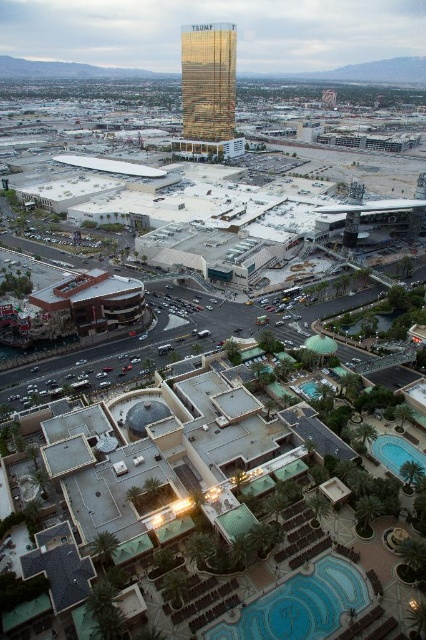
Does red brick building at center have a lesser width compared to blue glossy pool at lower right?

No.

Is red brick building at center shorter than blue glossy pool at lower right?

Incorrect, red brick building at center's height does not fall short of blue glossy pool at lower right's.

Between point (85, 308) and point (403, 458), which one is positioned behind?

The point (85, 308) is behind.

Where is `red brick building at center`? The image size is (426, 640). red brick building at center is located at coordinates (92, 301).

Is gold reflective building at center closer to the viewer compared to red brick building at center?

No, it is behind red brick building at center.

Between gold reflective building at center and red brick building at center, which one is positioned higher?

gold reflective building at center

Is point (187, 52) positioned after point (134, 307)?

Yes, point (187, 52) is behind point (134, 307).

Find the location of a particular element. The image size is (426, 640). gold reflective building at center is located at coordinates (207, 81).

Is blue glass pool at lower center bigger than gold reflective building at center?

Incorrect, blue glass pool at lower center is not larger than gold reflective building at center.

Image resolution: width=426 pixels, height=640 pixels. Describe the element at coordinates (301, 604) in the screenshot. I see `blue glass pool at lower center` at that location.

Where is `blue glass pool at lower center`? This screenshot has width=426, height=640. blue glass pool at lower center is located at coordinates (301, 604).